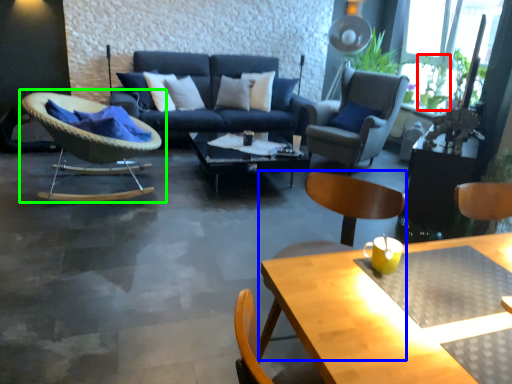
Question: Based on their relative distances, which object is farther from plant (highlighted by a red box)? Choose from beach chair (highlighted by a blue box) and chair (highlighted by a green box).

Choices:
 (A) beach chair
 (B) chair

Answer: (B)